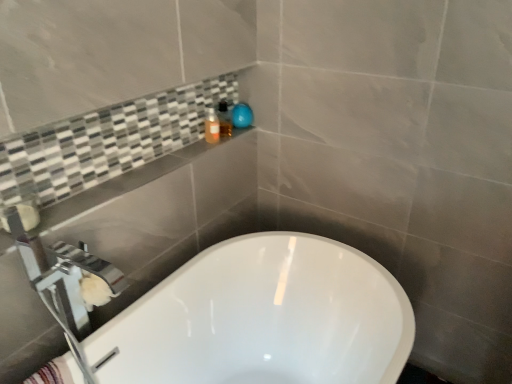
Question: Considering their positions, is striped cotton bath towel at lower left located in front of or behind matte orange bottle at upper center, which is counted as the 2th toiletry, starting from the right?

Choices:
 (A) behind
 (B) front

Answer: (B)

Question: Considering the positions of point (59, 365) and point (214, 119), is point (59, 365) closer or farther from the camera than point (214, 119)?

Choices:
 (A) closer
 (B) farther

Answer: (A)

Question: Which of these objects is positioned closest to the white glossy bathtub at center?

Choices:
 (A) translucent plastic soap dispenser at upper center, the first toiletry positioned from the right
 (B) chrome metallic tap at upper left
 (C) silver metallic faucet at lower left
 (D) striped cotton bath towel at lower left
 (E) matte orange bottle at upper center, which ranks as the first toiletry in left-to-right order

Answer: (B)

Question: Estimate the real-world distances between objects in this image. Which object is closer to the matte orange bottle at upper center, which is counted as the 2th toiletry, starting from the right?

Choices:
 (A) translucent plastic soap dispenser at upper center, the first toiletry positioned from the right
 (B) chrome metallic tap at upper left
 (C) white glossy bathtub at center
 (D) silver metallic faucet at lower left
 (E) striped cotton bath towel at lower left

Answer: (A)